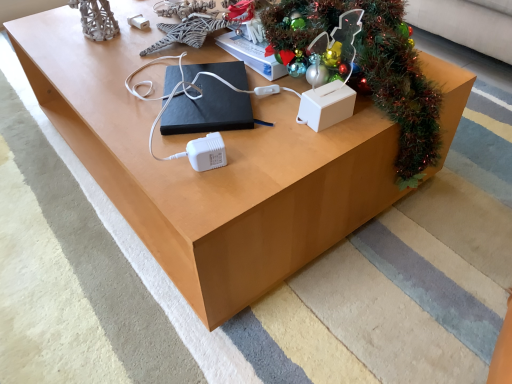
Find the location of `vacant space in front of white plastic tissue box at center-right`. vacant space in front of white plastic tissue box at center-right is located at coordinates (309, 151).